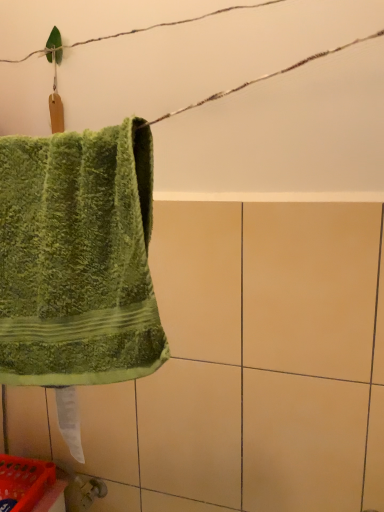
Measure the distance between green fuzzy towel at left and camera.

The distance of green fuzzy towel at left from camera is 17.69 inches.

What do you see at coordinates (78, 258) in the screenshot? The width and height of the screenshot is (384, 512). I see `green fuzzy towel at left` at bounding box center [78, 258].

Image resolution: width=384 pixels, height=512 pixels. Identify the location of green fuzzy towel at left. (78, 258).

This screenshot has height=512, width=384. Find the location of `orange plastic basket at lower left`. orange plastic basket at lower left is located at coordinates (24, 481).

The image size is (384, 512). Describe the element at coordinates (24, 481) in the screenshot. I see `orange plastic basket at lower left` at that location.

Where is `green fuzzy towel at left`? This screenshot has height=512, width=384. green fuzzy towel at left is located at coordinates (78, 258).

Which object is positioned more to the left, orange plastic basket at lower left or green fuzzy towel at left?

From the viewer's perspective, orange plastic basket at lower left appears more on the left side.

Is orange plastic basket at lower left further to the viewer compared to green fuzzy towel at left?

Yes, it is.

Does point (29, 493) come farther from viewer compared to point (97, 174)?

Yes, point (29, 493) is behind point (97, 174).

From the image's perspective, which is above, orange plastic basket at lower left or green fuzzy towel at left?

green fuzzy towel at left is shown above in the image.

From a real-world perspective, relative to green fuzzy towel at left, is orange plastic basket at lower left vertically above or below?

orange plastic basket at lower left is below green fuzzy towel at left.

Between orange plastic basket at lower left and green fuzzy towel at left, which one has larger width?

orange plastic basket at lower left is wider.

Who is taller, orange plastic basket at lower left or green fuzzy towel at left?

Standing taller between the two is green fuzzy towel at left.

Between orange plastic basket at lower left and green fuzzy towel at left, which one has smaller size?

With smaller size is orange plastic basket at lower left.

Is orange plastic basket at lower left inside the boundaries of green fuzzy towel at left, or outside?

orange plastic basket at lower left exists outside the volume of green fuzzy towel at left.

Can you see orange plastic basket at lower left touching green fuzzy towel at left?

No, orange plastic basket at lower left is not with green fuzzy towel at left.

Could you tell me if orange plastic basket at lower left is turned towards green fuzzy towel at left?

No, orange plastic basket at lower left is not turned towards green fuzzy towel at left.

Find the location of a particular element. The width and height of the screenshot is (384, 512). towel that appears on the right of orange plastic basket at lower left is located at coordinates (78, 258).

Is green fuzzy towel at left to the right of orange plastic basket at lower left from the viewer's perspective?

Indeed, green fuzzy towel at left is positioned on the right side of orange plastic basket at lower left.

Is green fuzzy towel at left closer to the viewer compared to orange plastic basket at lower left?

Yes, it is in front of orange plastic basket at lower left.

Does point (119, 305) come behind point (52, 470)?

No.

From the image's perspective, is green fuzzy towel at left positioned above or below orange plastic basket at lower left?

Based on their image positions, green fuzzy towel at left is located above orange plastic basket at lower left.

Consider the image. From a real-world perspective, does green fuzzy towel at left sit lower than orange plastic basket at lower left?

No.

Consider the image. Between green fuzzy towel at left and orange plastic basket at lower left, which one has larger width?

orange plastic basket at lower left is wider.

Between green fuzzy towel at left and orange plastic basket at lower left, which one has less height?

orange plastic basket at lower left.

Can you confirm if green fuzzy towel at left is bigger than orange plastic basket at lower left?

Correct, green fuzzy towel at left is larger in size than orange plastic basket at lower left.

Is green fuzzy towel at left positioned beyond the bounds of orange plastic basket at lower left?

green fuzzy towel at left lies outside orange plastic basket at lower left's area.

Is green fuzzy towel at left placed right next to orange plastic basket at lower left?

No, green fuzzy towel at left is not next to orange plastic basket at lower left.

Is green fuzzy towel at left turned away from orange plastic basket at lower left?

No.

The height and width of the screenshot is (512, 384). I want to click on towel lying in front of the orange plastic basket at lower left, so click(x=78, y=258).

The width and height of the screenshot is (384, 512). In order to click on basket that appears below the green fuzzy towel at left (from the image's perspective) in this screenshot , I will do `click(24, 481)`.

At what (x,y) coordinates should I click in order to perform the action: click on basket on the left of the green fuzzy towel at left. Please return your answer as a coordinate pair (x, y). The width and height of the screenshot is (384, 512). Looking at the image, I should click on (24, 481).